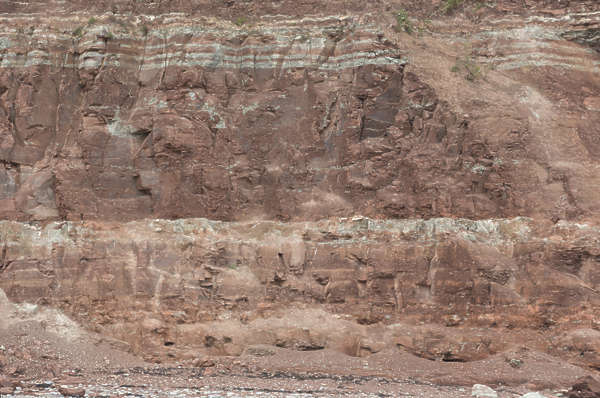
The height and width of the screenshot is (398, 600). In order to click on succulents in this screenshot , I will do `click(95, 24)`, `click(72, 40)`, `click(120, 33)`.